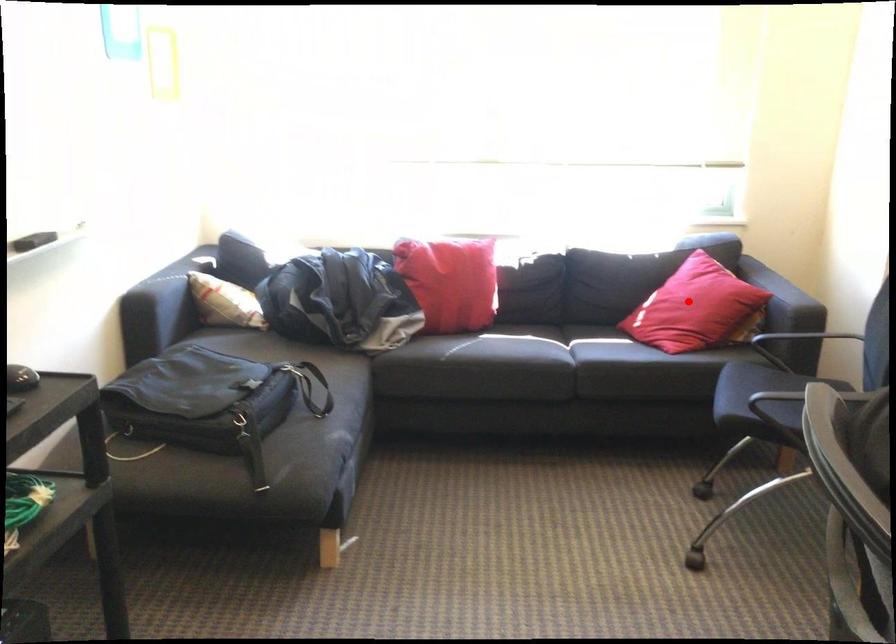
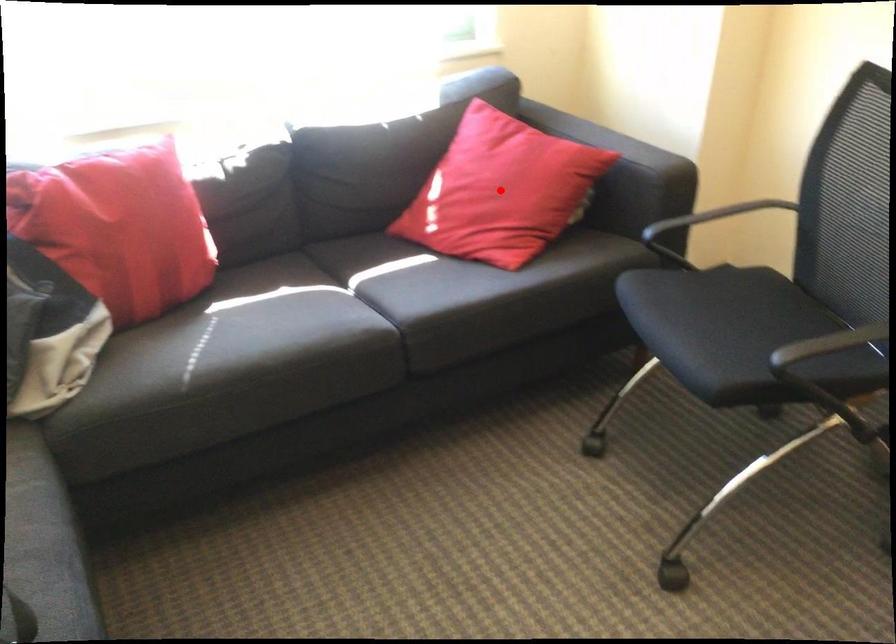
I am providing you with two images of the same scene from different viewpoints. A red point is marked on the first image and another point is marked on the second image. Is the marked point in image1 the same physical position as the marked point in image2?

Yes